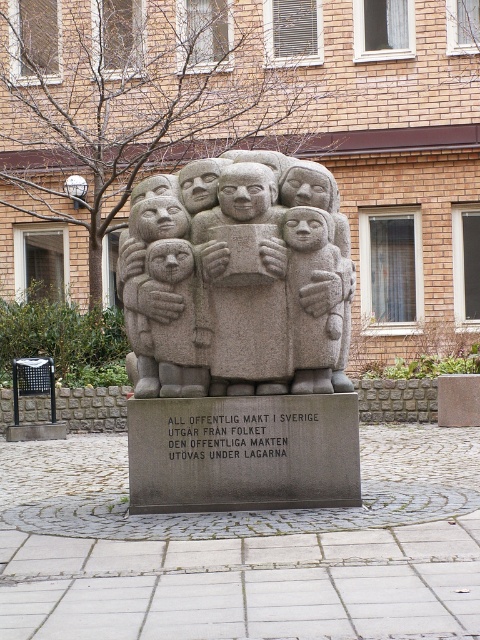
Question: Is granite sculpture at center below granite statue at center?

Choices:
 (A) yes
 (B) no

Answer: (A)

Question: Which of the following is the farthest from the observer?

Choices:
 (A) granite sculpture at center
 (B) granite statue at center

Answer: (A)

Question: Among these points, which one is farthest from the camera?

Choices:
 (A) (314, 224)
 (B) (225, 180)
 (C) (292, 253)

Answer: (C)

Question: Among these points, which one is nearest to the camera?

Choices:
 (A) (300, 244)
 (B) (225, 289)

Answer: (A)

Question: Can you confirm if granite sculpture at center is positioned below gray stone child at center?

Choices:
 (A) yes
 (B) no

Answer: (B)

Question: Does granite statue at center have a lesser width compared to gray stone child at center?

Choices:
 (A) no
 (B) yes

Answer: (A)